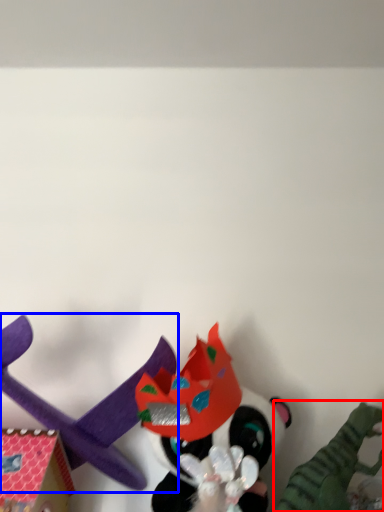
Question: Among these objects, which one is farthest to the camera, toy (highlighted by a red box) or toy (highlighted by a blue box)?

Choices:
 (A) toy
 (B) toy

Answer: (B)